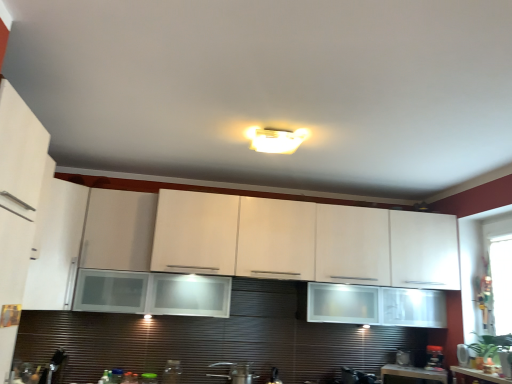
Identify the location of transparent glass window screen at right. The width and height of the screenshot is (512, 384). (501, 282).

Describe the element at coordinates (236, 372) in the screenshot. I see `satin silver faucet at center, which appears as the third appliance when viewed from the left` at that location.

How much space does satin silver faucet at center, arranged as the 5th appliance when viewed from the right, occupy vertically?

6.26 inches.

This screenshot has height=384, width=512. In order to click on metallic silver toaster at lower center, marked as the second appliance in a left-to-right arrangement in this screenshot , I will do [x=172, y=372].

The height and width of the screenshot is (384, 512). Find the location of `transparent glass window screen at right`. transparent glass window screen at right is located at coordinates (x=501, y=282).

Would you say black plastic coffee maker at lower right, placed as the sixth appliance when sorted from left to right, is to the left or to the right of metallic silver toaster at lower right, positioned as the 5th appliance in left-to-right order, in the picture?

Based on their positions, black plastic coffee maker at lower right, placed as the sixth appliance when sorted from left to right, is located to the right of metallic silver toaster at lower right, positioned as the 5th appliance in left-to-right order.

Looking at the image, does black plastic coffee maker at lower right, the second appliance when ordered from right to left, seem bigger or smaller compared to metallic silver toaster at lower right, which is the 3th appliance in right-to-left order?

In the image, black plastic coffee maker at lower right, the second appliance when ordered from right to left, appears to be larger than metallic silver toaster at lower right, which is the 3th appliance in right-to-left order.

Measure the distance from black plastic coffee maker at lower right, placed as the sixth appliance when sorted from left to right, to metallic silver toaster at lower right, positioned as the 5th appliance in left-to-right order.

A distance of 7.36 inches exists between black plastic coffee maker at lower right, placed as the sixth appliance when sorted from left to right, and metallic silver toaster at lower right, positioned as the 5th appliance in left-to-right order.

Does black plastic coffee maker at lower right, placed as the sixth appliance when sorted from left to right, turn towards metallic silver toaster at lower right, positioned as the 5th appliance in left-to-right order?

No.

Which of these two, white glossy microwave at upper right, which ranks as the first appliance in right-to-left order, or green plastic lid at lower center, the first appliance when ordered from left to right, is thinner?

white glossy microwave at upper right, which ranks as the first appliance in right-to-left order, is thinner.

From the picture: How far apart are white glossy microwave at upper right, which ranks as the first appliance in right-to-left order, and green plastic lid at lower center, the 7th appliance from the right?

The distance of white glossy microwave at upper right, which ranks as the first appliance in right-to-left order, from green plastic lid at lower center, the 7th appliance from the right, is 7.76 feet.

Which point is more forward, (459, 355) or (147, 380)?

The point (147, 380) is in front.

Based on the photo, does white glossy microwave at upper right, which ranks as the first appliance in right-to-left order, have a larger size compared to green plastic lid at lower center, the 7th appliance from the right?

Actually, white glossy microwave at upper right, which ranks as the first appliance in right-to-left order, might be smaller than green plastic lid at lower center, the 7th appliance from the right.

Can you confirm if white glossy countertop at lower right is positioned to the left of matte yellow plastic light fixture at center?

Incorrect, white glossy countertop at lower right is not on the left side of matte yellow plastic light fixture at center.

Is the depth of white glossy countertop at lower right greater than that of matte yellow plastic light fixture at center?

Yes, white glossy countertop at lower right is further from the camera.

Does white glossy countertop at lower right have a lesser height compared to matte yellow plastic light fixture at center?

In fact, white glossy countertop at lower right may be taller than matte yellow plastic light fixture at center.

Can you tell me how much metallic silver toaster at lower right, positioned as the 5th appliance in left-to-right order, and white matte cabinet at left, marked as the 2th cabinetry in a right-to-left arrangement, differ in facing direction?

There is a 36.1-degree angle between the facing directions of metallic silver toaster at lower right, positioned as the 5th appliance in left-to-right order, and white matte cabinet at left, marked as the 2th cabinetry in a right-to-left arrangement.

Is metallic silver toaster at lower right, which is the 3th appliance in right-to-left order, at the right side of white matte cabinet at left, which ranks as the first cabinetry in left-to-right order?

Indeed, metallic silver toaster at lower right, which is the 3th appliance in right-to-left order, is positioned on the right side of white matte cabinet at left, which ranks as the first cabinetry in left-to-right order.

Based on the photo, from a real-world perspective, is metallic silver toaster at lower right, which is the 3th appliance in right-to-left order, beneath white matte cabinet at left, marked as the 2th cabinetry in a right-to-left arrangement?

Indeed, from a real-world perspective, metallic silver toaster at lower right, which is the 3th appliance in right-to-left order, is positioned beneath white matte cabinet at left, marked as the 2th cabinetry in a right-to-left arrangement.

You are a GUI agent. You are given a task and a screenshot of the screen. Output one action in this format:
    pyautogui.click(x=<x>, y=<y>)
    Task: Click on the 2nd appliance counting from the right of the green plastic lid at lower center, the 7th appliance from the right
    This screenshot has width=512, height=384.
    Given the screenshot: What is the action you would take?
    pyautogui.click(x=236, y=372)

From the image's perspective, would you say satin silver faucet at center, which appears as the third appliance when viewed from the left, is shown under green plastic lid at lower center, the 7th appliance from the right?

Actually, satin silver faucet at center, which appears as the third appliance when viewed from the left, appears above green plastic lid at lower center, the 7th appliance from the right, in the image.

Between point (236, 365) and point (151, 376), which one is positioned in front?

Positioned in front is point (151, 376).

Are satin silver faucet at center, which appears as the third appliance when viewed from the left, and green plastic lid at lower center, the first appliance when ordered from left to right, making contact?

No, satin silver faucet at center, which appears as the third appliance when viewed from the left, is not in contact with green plastic lid at lower center, the first appliance when ordered from left to right.

From a real-world perspective, is transparent glass window screen at right beneath white glossy countertop at lower right?

No.

Based on their sizes in the image, would you say transparent glass window screen at right is bigger or smaller than white glossy countertop at lower right?

Considering their sizes, transparent glass window screen at right takes up more space than white glossy countertop at lower right.

Is white glossy countertop at lower right located within transparent glass window screen at right?

Actually, white glossy countertop at lower right is outside transparent glass window screen at right.

Considering the sizes of transparent glass window screen at right and white glossy countertop at lower right in the image, is transparent glass window screen at right taller or shorter than white glossy countertop at lower right?

Considering their sizes, transparent glass window screen at right has more height than white glossy countertop at lower right.

Is point (151, 380) farther from viewer compared to point (426, 369)?

No, it is not.

Locate an element on the screen. the 4th appliance in front of the black plastic coffee maker at lower right, the second appliance when ordered from right to left is located at coordinates 148,378.

Is green plastic lid at lower center, the first appliance when ordered from left to right, next to black plastic coffee maker at lower right, the second appliance when ordered from right to left, and touching it?

No, green plastic lid at lower center, the first appliance when ordered from left to right, is not making contact with black plastic coffee maker at lower right, the second appliance when ordered from right to left.

What are the coordinates of `appliance that appears behind the black plastic coffee maker at lower right, the second appliance when ordered from right to left` in the screenshot? It's located at (405, 357).

Locate an element on the screen. appliance that is the 6th one above the green plastic lid at lower center, the 7th appliance from the right (from a real-world perspective) is located at coordinates 463,355.

Considering their positions, is transparent glass window screen at right positioned further to satin silver faucet at center, arranged as the 5th appliance when viewed from the right, than white glossy microwave at upper right, which ranks as the first appliance in right-to-left order?

transparent glass window screen at right is positioned further to the anchor satin silver faucet at center, arranged as the 5th appliance when viewed from the right.

From the image, which object appears to be nearer to green plastic lid at lower center, the first appliance when ordered from left to right, matte yellow plastic light fixture at center or transparent glass window screen at right?

Among the two, matte yellow plastic light fixture at center is located nearer to green plastic lid at lower center, the first appliance when ordered from left to right.

Based on the photo, based on their spatial positions, is white glossy countertop at lower right or white glossy cabinet at upper center, which appears as the first cabinetry when viewed from the right, closer to white glossy microwave at upper right, which is the 7th appliance from left to right?

white glossy countertop at lower right is positioned closer to the anchor white glossy microwave at upper right, which is the 7th appliance from left to right.

When comparing their distances from black glossy coffee maker at lower center, acting as the 4th appliance starting from the right, does white glossy microwave at upper right, which ranks as the first appliance in right-to-left order, or white glossy countertop at lower right seem closer?

white glossy countertop at lower right lies closer to black glossy coffee maker at lower center, acting as the 4th appliance starting from the right, than the other object.

From the image, which object appears to be nearer to metallic silver toaster at lower center, which is the sixth appliance from right to left, black plastic coffee maker at lower right, placed as the sixth appliance when sorted from left to right, or white matte cabinet at left, which ranks as the first cabinetry in left-to-right order?

white matte cabinet at left, which ranks as the first cabinetry in left-to-right order, is closer to metallic silver toaster at lower center, which is the sixth appliance from right to left.

When comparing their distances from black plastic coffee maker at lower right, placed as the sixth appliance when sorted from left to right, does white glossy cabinet at upper center, the 2th cabinetry positioned from the left, or metallic silver toaster at lower center, marked as the second appliance in a left-to-right arrangement, seem further?

metallic silver toaster at lower center, marked as the second appliance in a left-to-right arrangement, lies further to black plastic coffee maker at lower right, placed as the sixth appliance when sorted from left to right, than the other object.

Considering their positions, is matte yellow plastic light fixture at center positioned further to white glossy countertop at lower right than black glossy coffee maker at lower center, the fourth appliance positioned from the left?

matte yellow plastic light fixture at center lies further to white glossy countertop at lower right than the other object.

Based on their spatial positions, is black glossy coffee maker at lower center, acting as the 4th appliance starting from the right, or satin silver faucet at center, which appears as the third appliance when viewed from the left, closer to matte yellow plastic light fixture at center?

The object closer to matte yellow plastic light fixture at center is satin silver faucet at center, which appears as the third appliance when viewed from the left.

Image resolution: width=512 pixels, height=384 pixels. What are the coordinates of `counter top between matte yellow plastic light fixture at center and white glossy countertop at lower right vertically` in the screenshot? It's located at (480, 375).

Find the location of a particular element. The width and height of the screenshot is (512, 384). light fixture located between green plastic lid at lower center, the 7th appliance from the right, and white glossy countertop at lower right in the left-right direction is located at coordinates (275, 139).

This screenshot has width=512, height=384. I want to click on cabinetry between metallic silver toaster at lower center, marked as the second appliance in a left-to-right arrangement, and white glossy microwave at upper right, which ranks as the first appliance in right-to-left order, in the horizontal direction, so click(269, 239).

Identify the location of light fixture between metallic silver toaster at lower center, which is the sixth appliance from right to left, and white glossy microwave at upper right, which ranks as the first appliance in right-to-left order, in the horizontal direction. (275, 139).